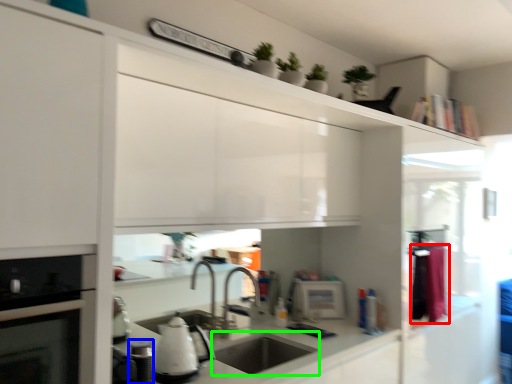
Question: Based on their relative distances, which object is nearer to laundry (highlighted by a red box)? Choose from appliance (highlighted by a blue box) and sink (highlighted by a green box).

Choices:
 (A) appliance
 (B) sink

Answer: (B)